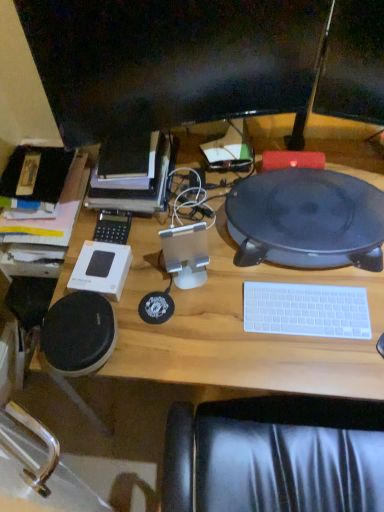
Question: Is white plastic keyboard at lower right facing towards matte black tablet at center?

Choices:
 (A) no
 (B) yes

Answer: (A)

Question: From the image's perspective, is white plastic keyboard at lower right below matte black tablet at center?

Choices:
 (A) no
 (B) yes

Answer: (B)

Question: Considering the relative sizes of white plastic keyboard at lower right and matte black tablet at center in the image provided, is white plastic keyboard at lower right thinner than matte black tablet at center?

Choices:
 (A) yes
 (B) no

Answer: (A)

Question: Is white plastic keyboard at lower right placed right next to matte black tablet at center?

Choices:
 (A) yes
 (B) no

Answer: (B)

Question: Is white plastic keyboard at lower right taller than matte black tablet at center?

Choices:
 (A) no
 (B) yes

Answer: (A)

Question: Is white plastic keyboard at lower right facing away from matte black tablet at center?

Choices:
 (A) no
 (B) yes

Answer: (B)

Question: From a real-world perspective, is black glossy monitor at upper center positioned over white plastic keyboard at lower right based on gravity?

Choices:
 (A) no
 (B) yes

Answer: (B)

Question: Does black glossy monitor at upper center have a lesser width compared to white plastic keyboard at lower right?

Choices:
 (A) no
 (B) yes

Answer: (B)

Question: Does black glossy monitor at upper center have a greater height compared to white plastic keyboard at lower right?

Choices:
 (A) yes
 (B) no

Answer: (A)

Question: Is black glossy monitor at upper center closer to camera compared to white plastic keyboard at lower right?

Choices:
 (A) no
 (B) yes

Answer: (B)

Question: Is black glossy monitor at upper center with white plastic keyboard at lower right?

Choices:
 (A) no
 (B) yes

Answer: (A)

Question: Would you say black glossy monitor at upper center is outside white plastic keyboard at lower right?

Choices:
 (A) yes
 (B) no

Answer: (A)

Question: From a real-world perspective, is black plastic calculator at center-left beneath matte black tablet at center?

Choices:
 (A) no
 (B) yes

Answer: (B)